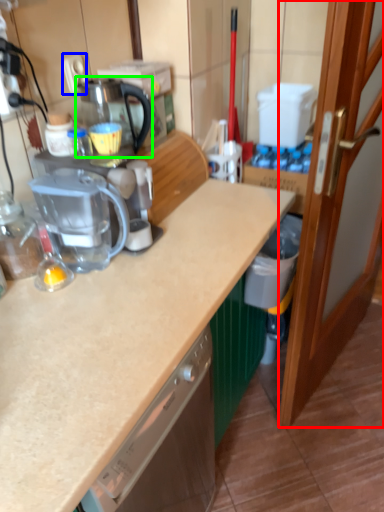
Question: Which object is positioned farthest from door (highlighted by a red box)? Select from electric outlet (highlighted by a blue box) and coffeepot (highlighted by a green box).

Choices:
 (A) electric outlet
 (B) coffeepot

Answer: (A)